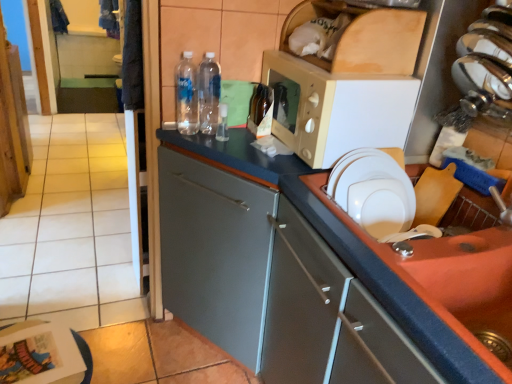
Question: Is matte gray cabinet at center wider than beige plastic microwave at upper center?

Choices:
 (A) no
 (B) yes

Answer: (B)

Question: Could beige plastic microwave at upper center be considered to be inside matte gray cabinet at center?

Choices:
 (A) no
 (B) yes

Answer: (A)

Question: Is the position of matte gray cabinet at center more distant than that of beige plastic microwave at upper center?

Choices:
 (A) no
 (B) yes

Answer: (B)

Question: From a real-world perspective, does matte gray cabinet at center stand above beige plastic microwave at upper center?

Choices:
 (A) yes
 (B) no

Answer: (B)

Question: From a real-world perspective, does matte gray cabinet at center sit lower than beige plastic microwave at upper center?

Choices:
 (A) yes
 (B) no

Answer: (A)

Question: Is matte gray cabinet at center bigger than beige plastic microwave at upper center?

Choices:
 (A) yes
 (B) no

Answer: (A)

Question: Does white matte paper plate at right come in front of beige plastic microwave at upper center?

Choices:
 (A) no
 (B) yes

Answer: (B)

Question: Can beige plastic microwave at upper center be found inside white matte paper plate at right?

Choices:
 (A) no
 (B) yes

Answer: (A)

Question: Is white matte paper plate at right outside of beige plastic microwave at upper center?

Choices:
 (A) yes
 (B) no

Answer: (A)

Question: Is white matte paper plate at right to the right of beige plastic microwave at upper center from the viewer's perspective?

Choices:
 (A) no
 (B) yes

Answer: (B)

Question: Are white matte paper plate at right and beige plastic microwave at upper center beside each other?

Choices:
 (A) yes
 (B) no

Answer: (B)

Question: Can you confirm if white matte paper plate at right is taller than beige plastic microwave at upper center?

Choices:
 (A) yes
 (B) no

Answer: (B)

Question: Considering the relative sizes of transparent plastic bottles at center, placed as the 2th bottle when sorted from right to left, and beige plastic microwave at upper center in the image provided, is transparent plastic bottles at center, placed as the 2th bottle when sorted from right to left, bigger than beige plastic microwave at upper center?

Choices:
 (A) no
 (B) yes

Answer: (A)